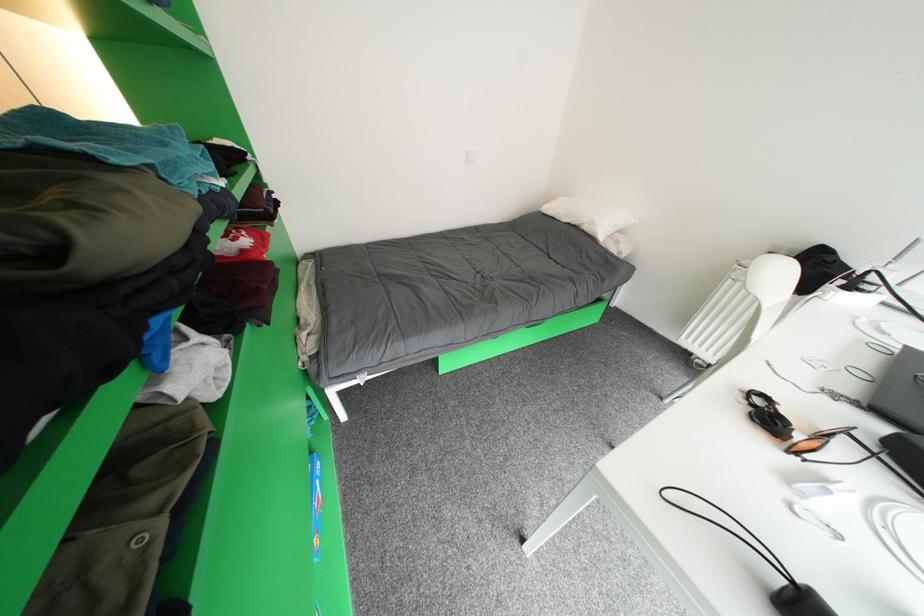
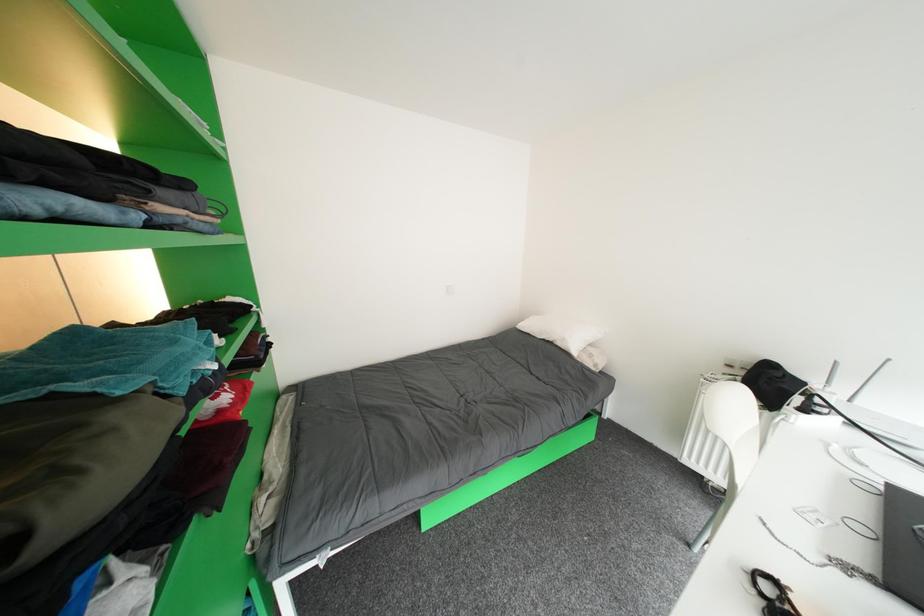
Question: Based on the continuous images, in which direction is the camera rotating? Reply with the corresponding letter.

Choices:
 (A) Left
 (B) Right
 (C) Up
 (D) Down

Answer: (C)